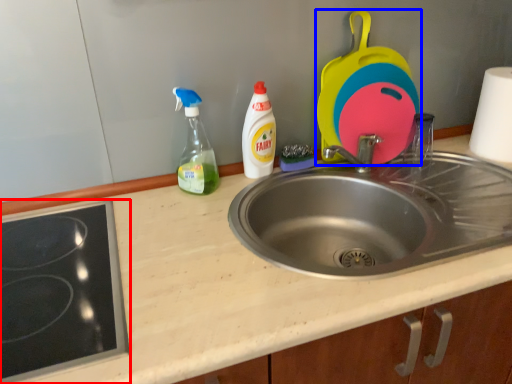
Question: Which of the following is the closest to the observer, gas stove (highlighted by a red box) or appliance (highlighted by a blue box)?

Choices:
 (A) gas stove
 (B) appliance

Answer: (A)